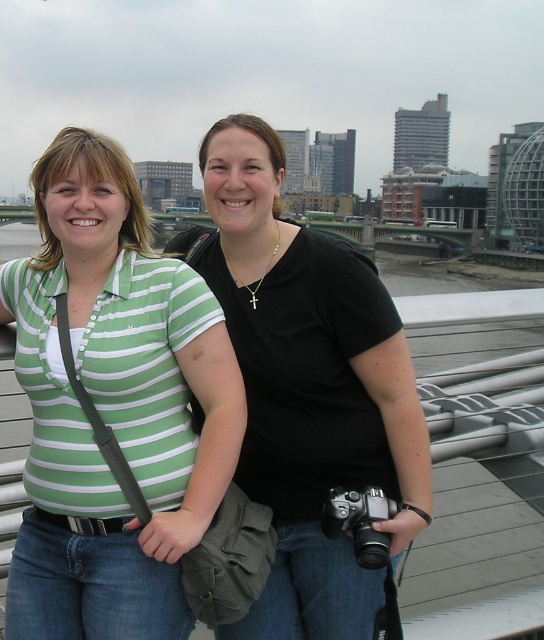
Question: Does green striped shirt at left appear on the left side of black matte shirt at center?

Choices:
 (A) yes
 (B) no

Answer: (A)

Question: Which of the following is the farthest from the observer?

Choices:
 (A) (385, 561)
 (B) (88, 467)

Answer: (B)

Question: Which point is closer to the camera?

Choices:
 (A) black matte shirt at center
 (B) green striped shirt at left

Answer: (B)

Question: Considering the relative positions of green striped shirt at left and silver metallic camera at lower center in the image provided, where is green striped shirt at left located with respect to silver metallic camera at lower center?

Choices:
 (A) below
 (B) above

Answer: (B)

Question: Does black matte shirt at center have a lesser width compared to silver metallic camera at lower center?

Choices:
 (A) no
 (B) yes

Answer: (A)

Question: Which point is closer to the camera?

Choices:
 (A) (298, 451)
 (B) (332, 506)
 (C) (92, 449)

Answer: (C)